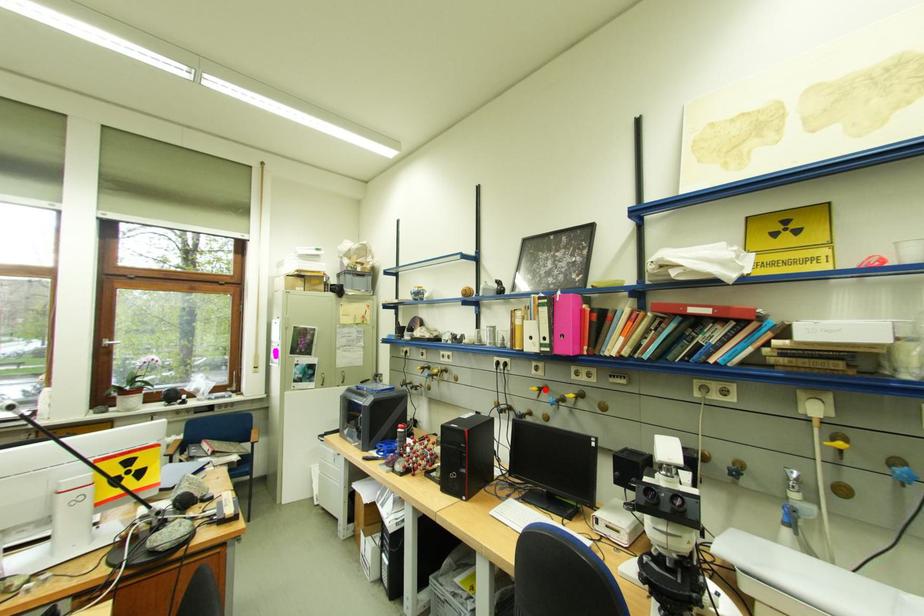
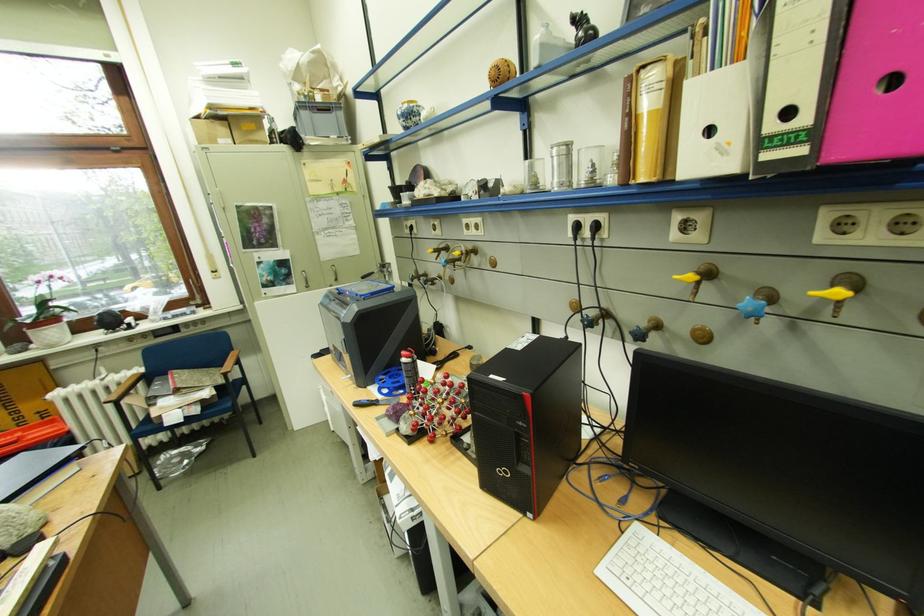
Where in the second image is the point corresponding to the highlighted location from the first image?

(700, 277)